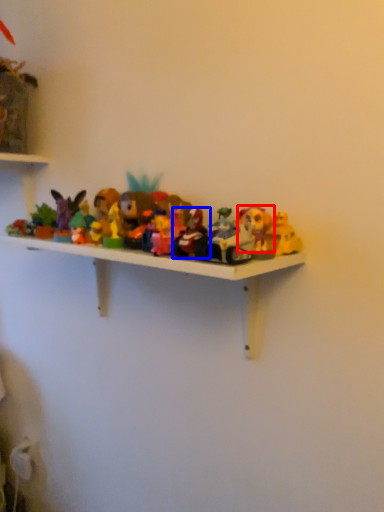
Question: Among these objects, which one is nearest to the camera, toy (highlighted by a red box) or toy (highlighted by a blue box)?

Choices:
 (A) toy
 (B) toy

Answer: (B)